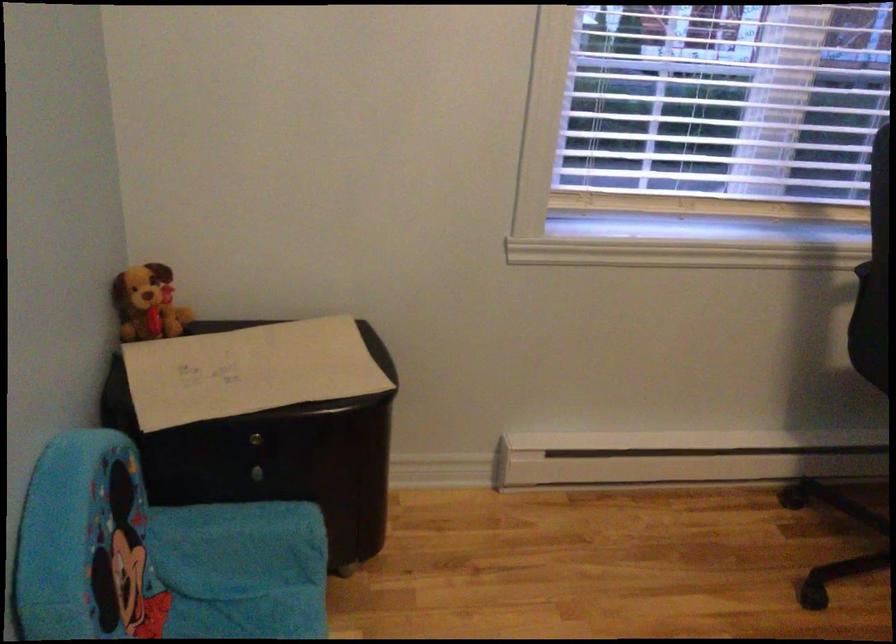
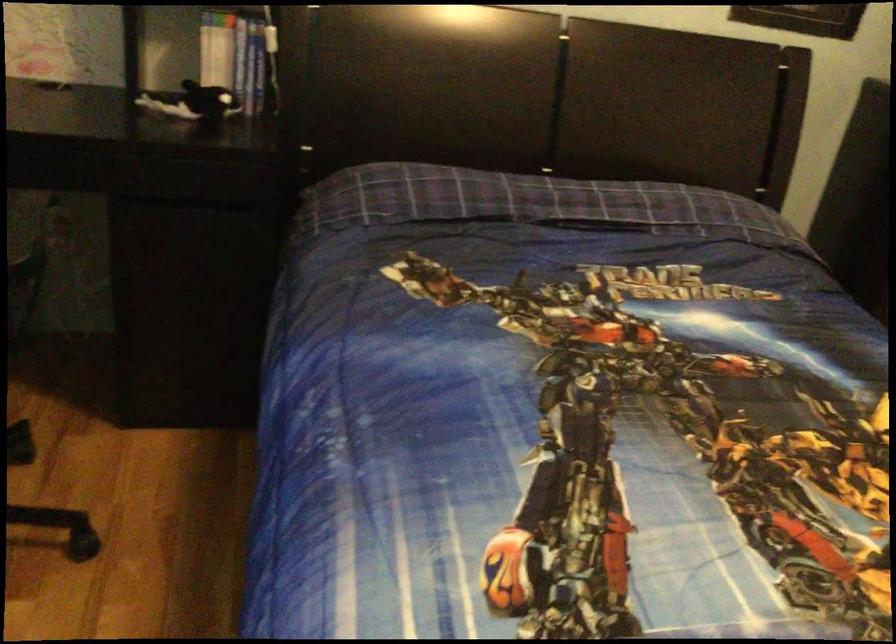
The first image is from the beginning of the video and the second image is from the end. How did the camera likely rotate when shooting the video?

The rotation direction of the camera is right-down.